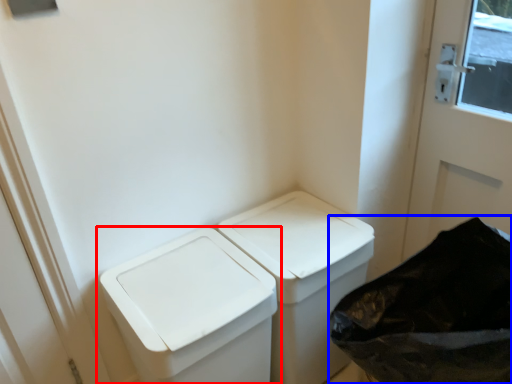
Question: Which object is closer to the camera taking this photo, waste container (highlighted by a red box) or recycling bin (highlighted by a blue box)?

Choices:
 (A) waste container
 (B) recycling bin

Answer: (B)